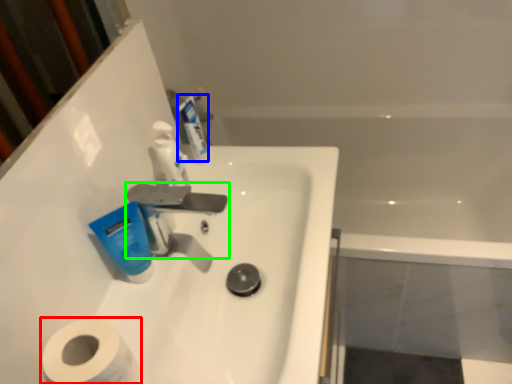
Question: Which object is the closest to the toilet paper (highlighted by a red box)? Choose among these: mouthwash (highlighted by a blue box) or tap (highlighted by a green box).

Choices:
 (A) mouthwash
 (B) tap

Answer: (B)